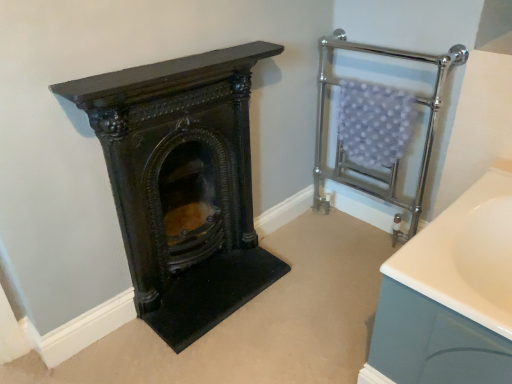
In order to click on vacant space underneath dark brown wood at left (from a real-world perspective) in this screenshot , I will do `click(205, 268)`.